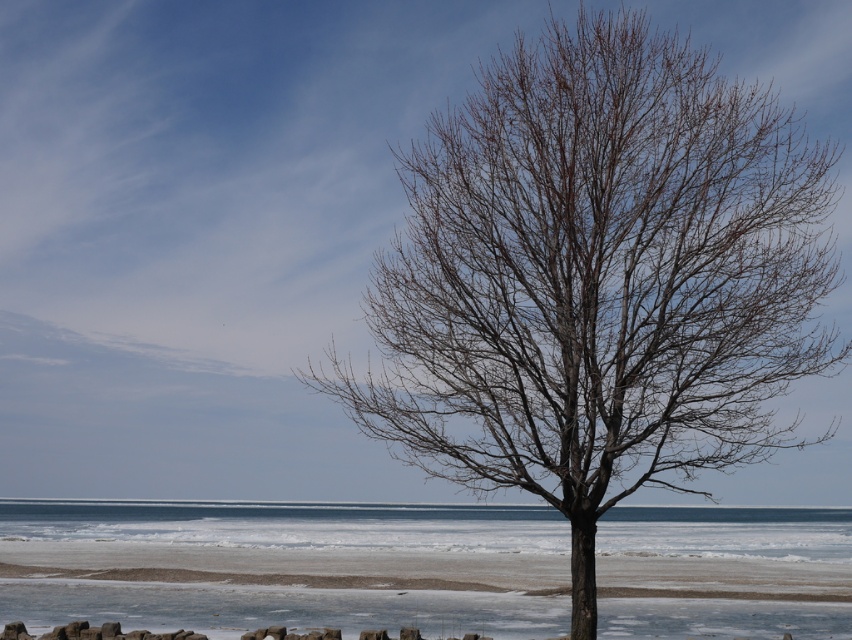
Is bare branches at center smaller than frozen ice at lower center?

Correct, bare branches at center occupies less space than frozen ice at lower center.

Does bare branches at center appear on the left side of frozen ice at lower center?

Incorrect, bare branches at center is not on the left side of frozen ice at lower center.

Describe the element at coordinates (597, 278) in the screenshot. This screenshot has width=852, height=640. I see `bare branches at center` at that location.

This screenshot has height=640, width=852. What are the coordinates of `bare branches at center` in the screenshot? It's located at (597, 278).